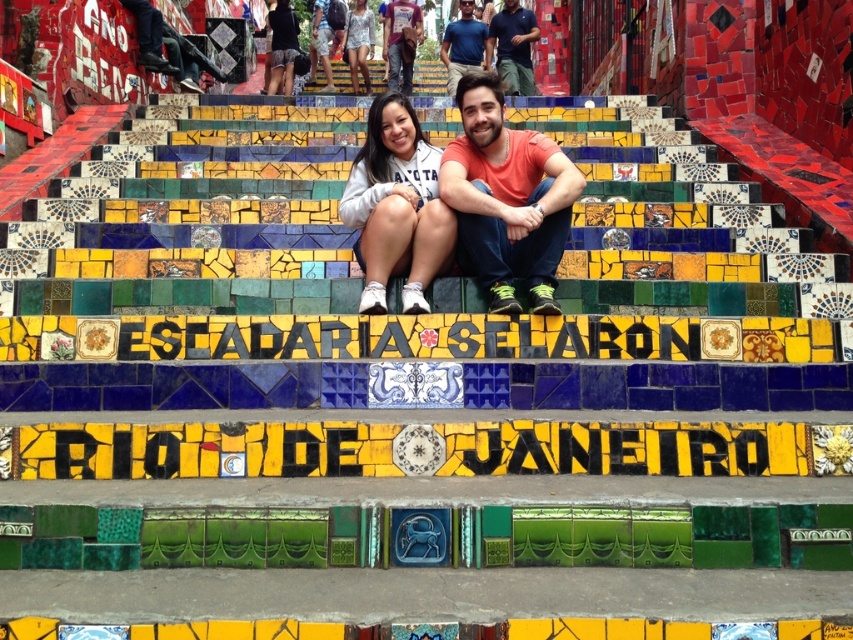
You are standing at the bottom of the Escadaria Selaroon and looking up at the staircase. You notice two points marked on the steps. One is at point coordinates point (398, 38) and the other is point (467, 33). Which point is closer to you?

Point (467, 33) is closer to you because it is less further to the camera than point (398, 38).